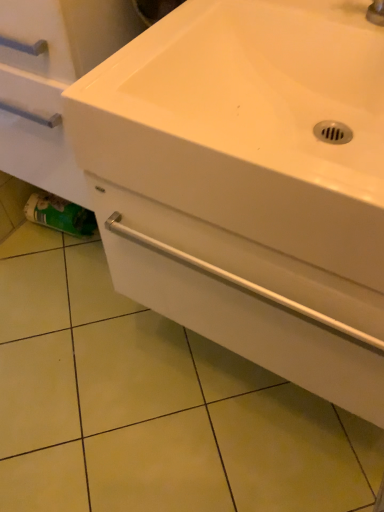
Question: Does white glossy drawer at center have a smaller size compared to green matte toilet paper at lower left?

Choices:
 (A) yes
 (B) no

Answer: (B)

Question: Is white glossy drawer at center not near green matte toilet paper at lower left?

Choices:
 (A) yes
 (B) no

Answer: (B)

Question: Is white glossy drawer at center further to the viewer compared to green matte toilet paper at lower left?

Choices:
 (A) no
 (B) yes

Answer: (A)

Question: Is white glossy drawer at center to the right of green matte toilet paper at lower left from the viewer's perspective?

Choices:
 (A) no
 (B) yes

Answer: (B)

Question: From the image's perspective, is white glossy drawer at center on top of green matte toilet paper at lower left?

Choices:
 (A) no
 (B) yes

Answer: (A)

Question: Does white glossy drawer at center have a lesser height compared to green matte toilet paper at lower left?

Choices:
 (A) yes
 (B) no

Answer: (B)

Question: Can you confirm if green matte toilet paper at lower left is taller than white glossy sink at center?

Choices:
 (A) no
 (B) yes

Answer: (A)

Question: Is green matte toilet paper at lower left positioned beyond the bounds of white glossy sink at center?

Choices:
 (A) no
 (B) yes

Answer: (B)

Question: From the image's perspective, is green matte toilet paper at lower left on white glossy sink at center?

Choices:
 (A) no
 (B) yes

Answer: (A)

Question: Does green matte toilet paper at lower left have a lesser height compared to white glossy sink at center?

Choices:
 (A) yes
 (B) no

Answer: (A)

Question: Does green matte toilet paper at lower left have a smaller size compared to white glossy sink at center?

Choices:
 (A) yes
 (B) no

Answer: (A)

Question: From a real-world perspective, does green matte toilet paper at lower left stand above white glossy sink at center?

Choices:
 (A) no
 (B) yes

Answer: (A)

Question: Can you confirm if green matte toilet paper at lower left is positioned to the right of white glossy drawer at center?

Choices:
 (A) no
 (B) yes

Answer: (A)